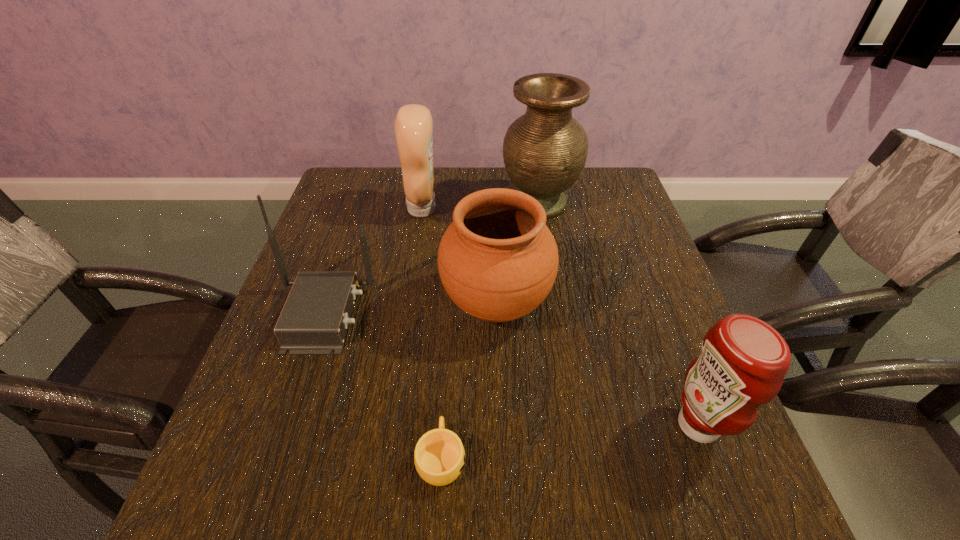
Locate an element on the screen. The image size is (960, 540). vacant point located on the back of the pottery is located at coordinates (494, 248).

I want to click on vacant region located 0.370m on the left of the shorter condiment, so click(461, 425).

The image size is (960, 540). Find the location of `vacant space situated 0.200m on the back of the leftmost object to connect cables`. vacant space situated 0.200m on the back of the leftmost object to connect cables is located at coordinates (463, 314).

Where is `free space located on the left of the cup`? The height and width of the screenshot is (540, 960). free space located on the left of the cup is located at coordinates (273, 457).

Image resolution: width=960 pixels, height=540 pixels. Find the location of `vase that is at the far edge`. vase that is at the far edge is located at coordinates (545, 150).

I want to click on condiment located in the far edge section of the desktop, so [413, 127].

Identify the location of object at the near edge. (439, 456).

Find the location of a particular element. The width and height of the screenshot is (960, 540). object located at the left edge is located at coordinates (314, 320).

Where is `vase located in the right edge section of the desktop`? The image size is (960, 540). vase located in the right edge section of the desktop is located at coordinates (545, 150).

Where is `condiment that is positioned at the right edge`? condiment that is positioned at the right edge is located at coordinates (743, 361).